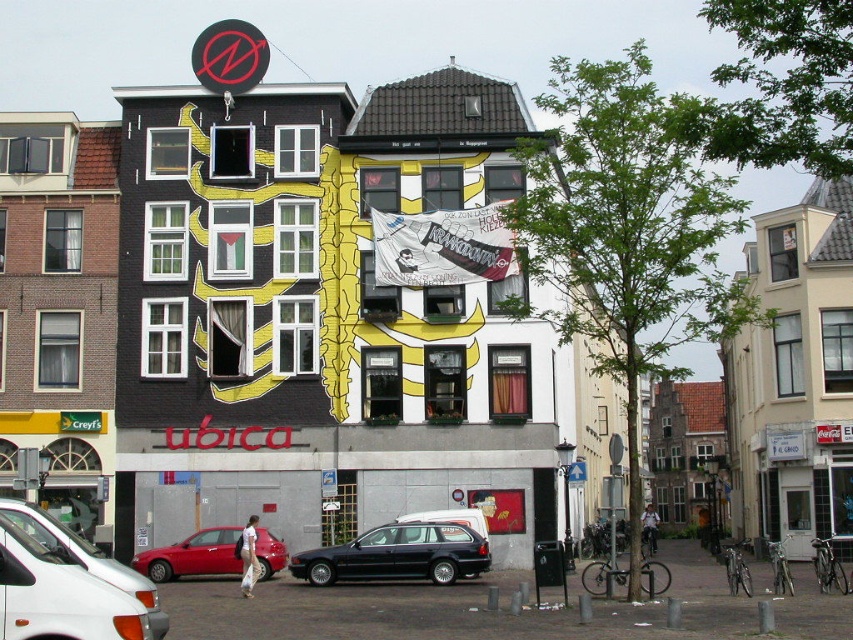
Question: Which is farther from the shiny red sedan at lower left?

Choices:
 (A) white matte van at lower left
 (B) metallic dark blue wagon at center

Answer: (A)

Question: Is white matte van at lower left above shiny red sedan at lower left?

Choices:
 (A) no
 (B) yes

Answer: (B)

Question: Where is metallic dark blue wagon at center located in relation to shiny red sedan at lower left in the image?

Choices:
 (A) below
 (B) above

Answer: (B)

Question: Is metallic dark blue wagon at center smaller than shiny red sedan at lower left?

Choices:
 (A) yes
 (B) no

Answer: (B)

Question: Which point appears closest to the camera in this image?

Choices:
 (A) (274, 561)
 (B) (294, 563)
 (C) (6, 563)

Answer: (C)

Question: Which point is farther from the camera taking this photo?

Choices:
 (A) (462, 561)
 (B) (218, 573)
 (C) (83, 589)

Answer: (B)